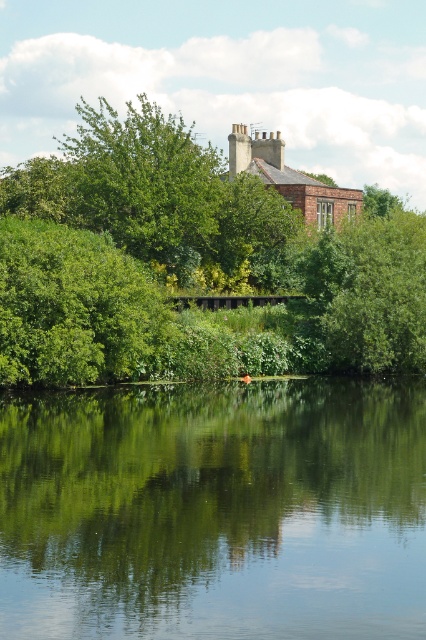
You are standing at the riverside and see the green reflective water at center and the green leafy tree at upper center. Which object is closer to the ground?

The green reflective water at center is closer to the ground because it is located below the green leafy tree at upper center.

You are a bird looking for a nesting spot. You see the green leafy tree at lower left and the green leafy tree at upper center. Which tree is taller and would provide a better vantage point?

The green leafy tree at lower left is taller than the green leafy tree at upper center, so it would provide a better vantage point for nesting.

From the picture: You are standing at the riverside and see two points marked in the image. Which point, point (325,236) or point (397,324), is closer to you?

Point (325,236) is closer to you because it is further to the viewer than point (397,324).